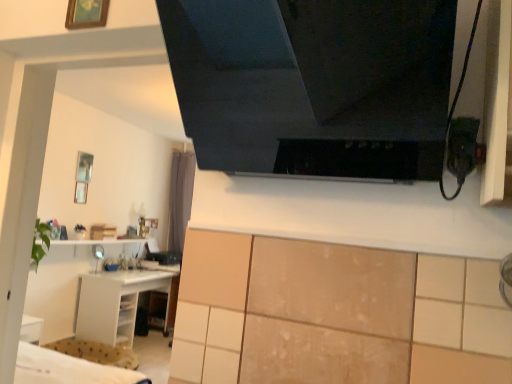
Question: Is black glossy exhaust hood at upper center at the right side of gray fabric curtain at center?

Choices:
 (A) yes
 (B) no

Answer: (A)

Question: Could you tell me if black glossy exhaust hood at upper center is facing gray fabric curtain at center?

Choices:
 (A) yes
 (B) no

Answer: (B)

Question: Does black glossy exhaust hood at upper center have a larger size compared to gray fabric curtain at center?

Choices:
 (A) yes
 (B) no

Answer: (B)

Question: From a real-world perspective, is black glossy exhaust hood at upper center on top of gray fabric curtain at center?

Choices:
 (A) no
 (B) yes

Answer: (B)

Question: Can you confirm if black glossy exhaust hood at upper center is positioned to the left of gray fabric curtain at center?

Choices:
 (A) yes
 (B) no

Answer: (B)

Question: Can you confirm if black glossy exhaust hood at upper center is shorter than gray fabric curtain at center?

Choices:
 (A) yes
 (B) no

Answer: (A)

Question: Considering the relative sizes of metallic silver picture frame at upper left, which is counted as the 2th picture frame, starting from the front, and black glossy exhaust hood at upper center in the image provided, is metallic silver picture frame at upper left, which is counted as the 2th picture frame, starting from the front, bigger than black glossy exhaust hood at upper center?

Choices:
 (A) yes
 (B) no

Answer: (B)

Question: Is metallic silver picture frame at upper left, placed as the first picture frame when sorted from left to right, at the right side of black glossy exhaust hood at upper center?

Choices:
 (A) yes
 (B) no

Answer: (B)

Question: From the image's perspective, is metallic silver picture frame at upper left, positioned as the 2th picture frame in top-to-bottom order, beneath black glossy exhaust hood at upper center?

Choices:
 (A) no
 (B) yes

Answer: (B)

Question: Does metallic silver picture frame at upper left, which is counted as the 2th picture frame, starting from the front, have a greater height compared to black glossy exhaust hood at upper center?

Choices:
 (A) no
 (B) yes

Answer: (A)

Question: Is metallic silver picture frame at upper left, placed as the first picture frame when sorted from left to right, further to the viewer compared to black glossy exhaust hood at upper center?

Choices:
 (A) yes
 (B) no

Answer: (A)

Question: Can you confirm if metallic silver picture frame at upper left, placed as the first picture frame when sorted from left to right, is smaller than black glossy exhaust hood at upper center?

Choices:
 (A) no
 (B) yes

Answer: (B)

Question: From a real-world perspective, is white glossy shelf at lower left positioned under wooden picture frame at upper left, acting as the 1th picture frame starting from the front, based on gravity?

Choices:
 (A) no
 (B) yes

Answer: (B)